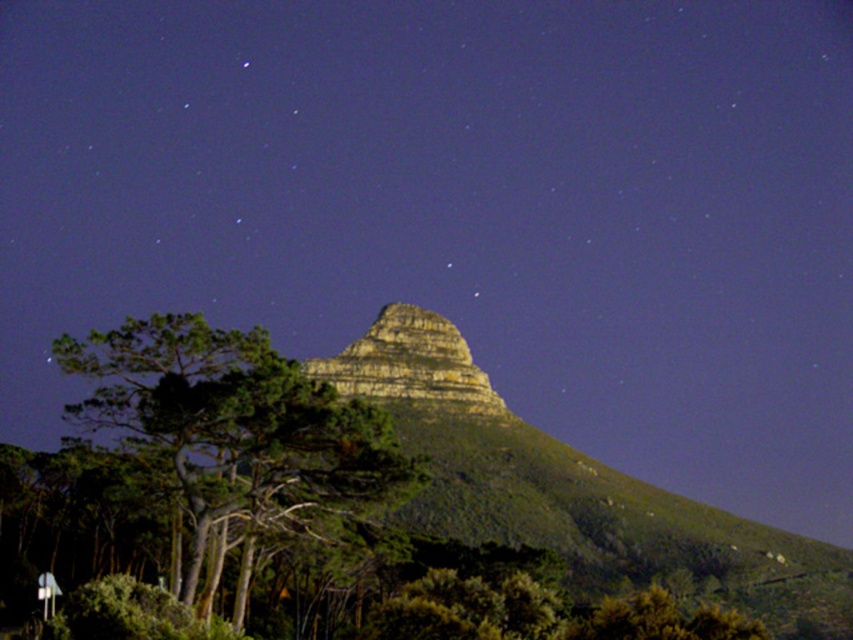
Is point (177, 368) closer to camera compared to point (387, 305)?

Yes.

Where is `green matte tree at center-left`? green matte tree at center-left is located at coordinates (236, 432).